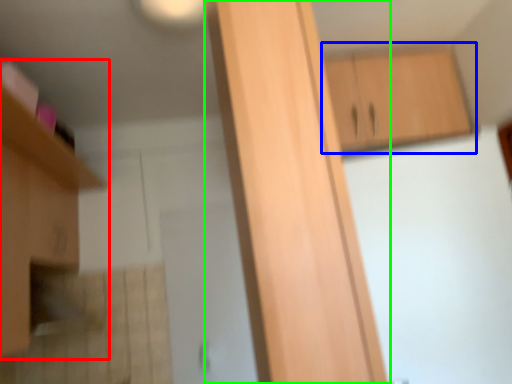
Question: Which object is the closest to the cabinetry (highlighted by a red box)? Choose among these: cabinetry (highlighted by a blue box) or cabinetry (highlighted by a green box).

Choices:
 (A) cabinetry
 (B) cabinetry

Answer: (B)